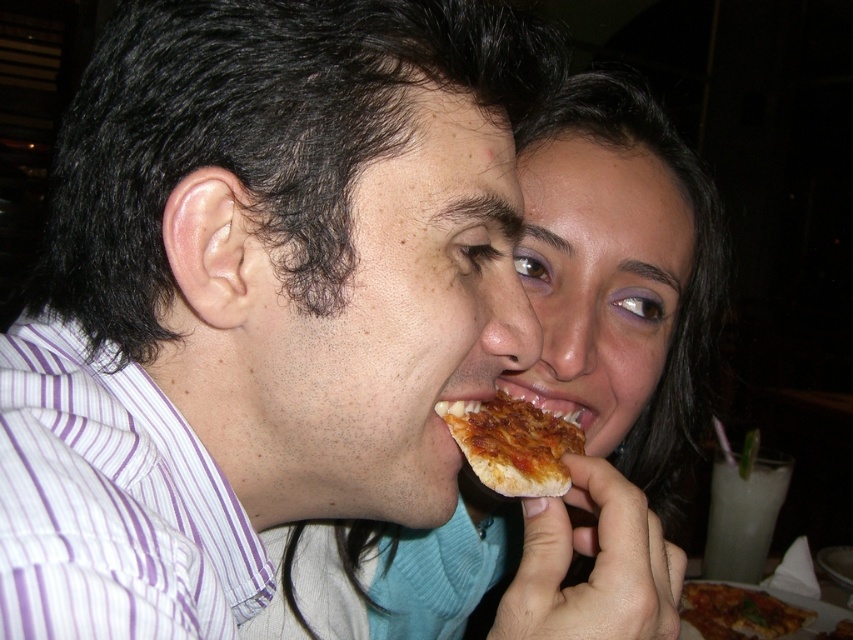
You are a fashion designer observing the scene. You need to decide which item, the smooth teal sweater at center or the golden crispy pizza at lower right, would require more fabric to create. Based on the size comparison provided, which one would need more material?

The smooth teal sweater at center is bigger than the golden crispy pizza at lower right, so it would require more fabric to create.

You are a photographer adjusting your camera settings to focus on two points in the image. The first point is point (463, 488) and the second is point (540, 458). Since you can only focus on one point at a time, which point should you choose to ensure the person closer to the camera is in focus?

Point (463, 488) should be chosen because it is closer to the camera than point (540, 458), ensuring the person nearer to the camera is in focus.

In the scene where two people are sharing a pizza slice, there is a smooth teal sweater at center and a golden crispy pizza slice at mouth. Which object is positioned to the right of the other?

The smooth teal sweater at center is to the right of the golden crispy pizza slice at mouth.